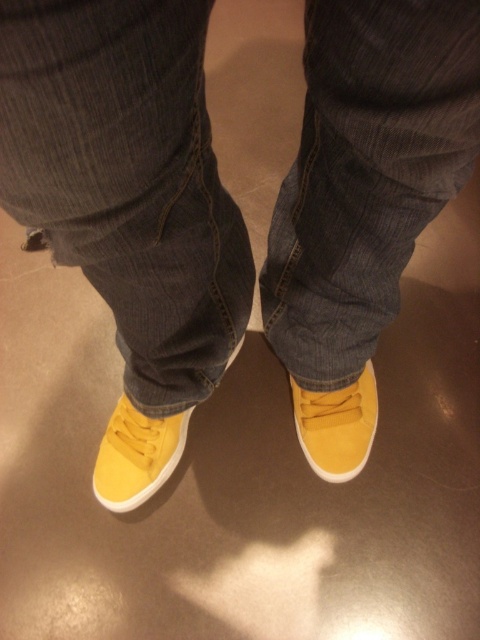
You are a fashion designer observing the image. You need to determine if the denim at center will cover the yellow suede shoe at lower center when the person bends forward. Based on the height difference between them, what is your conclusion?

The denim at center is taller than the yellow suede shoe at lower center, so when the person bends forward, the denim at center will likely cover part of the yellow suede shoe at lower center due to its greater height.

You are a photographer setting up a shoot in this scene. You need to position a small prop between the matte yellow sneaker at lower left and the yellow suede shoe at lower center. Based on their positions, where should you place the prop to ensure it is between them?

The matte yellow sneaker at lower left is below the yellow suede shoe at lower center. To place the prop between them, position it just above the matte yellow sneaker at lower left and below the yellow suede shoe at lower center.